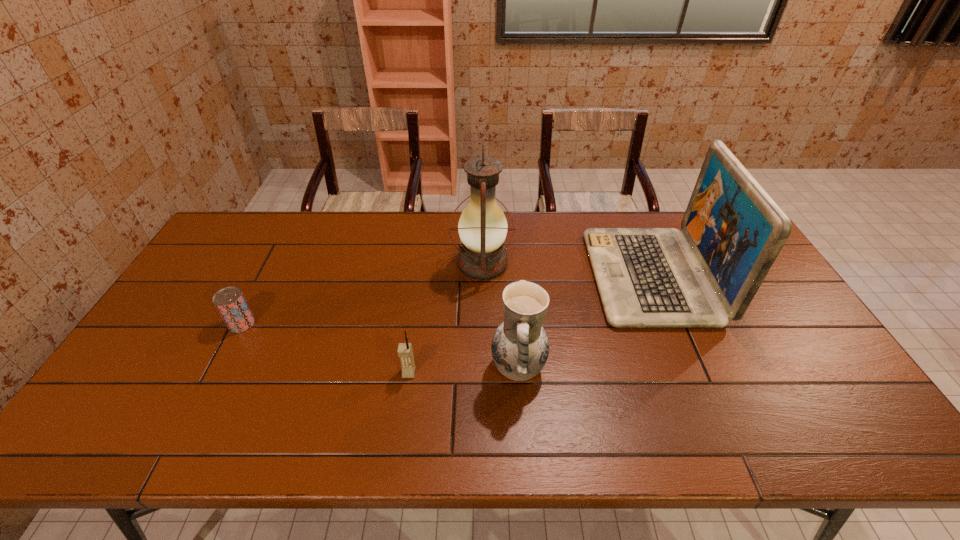
This screenshot has height=540, width=960. What are the coordinates of `oil lamp` in the screenshot? It's located at pos(482,227).

Where is `the second tallest object`? This screenshot has width=960, height=540. the second tallest object is located at coordinates (647, 277).

You are a GUI agent. You are given a task and a screenshot of the screen. Output one action in this format:
    pyautogui.click(x=<x>, y=<y>)
    Task: Click on the laptop computer
    
    Given the screenshot: What is the action you would take?
    pyautogui.click(x=647, y=277)

Find the location of a particular element. The image size is (960, 540). the third shortest object is located at coordinates (520, 347).

The image size is (960, 540). I want to click on the fourth tallest object, so [x=405, y=353].

At what (x,y) coordinates should I click in order to perform the action: click on the second object from left to right. Please return your answer as a coordinate pair (x, y). Looking at the image, I should click on (405, 353).

At what (x,y) coordinates should I click in order to perform the action: click on the leftmost object. Please return your answer as a coordinate pair (x, y). This screenshot has height=540, width=960. Looking at the image, I should click on (230, 302).

Find the location of `beer can`. beer can is located at coordinates (230, 302).

This screenshot has width=960, height=540. I want to click on free location located 0.250m on the left of the oil lamp, so click(x=373, y=263).

Find the location of a particular element. free space located on the screen of the fourth shortest object is located at coordinates (539, 276).